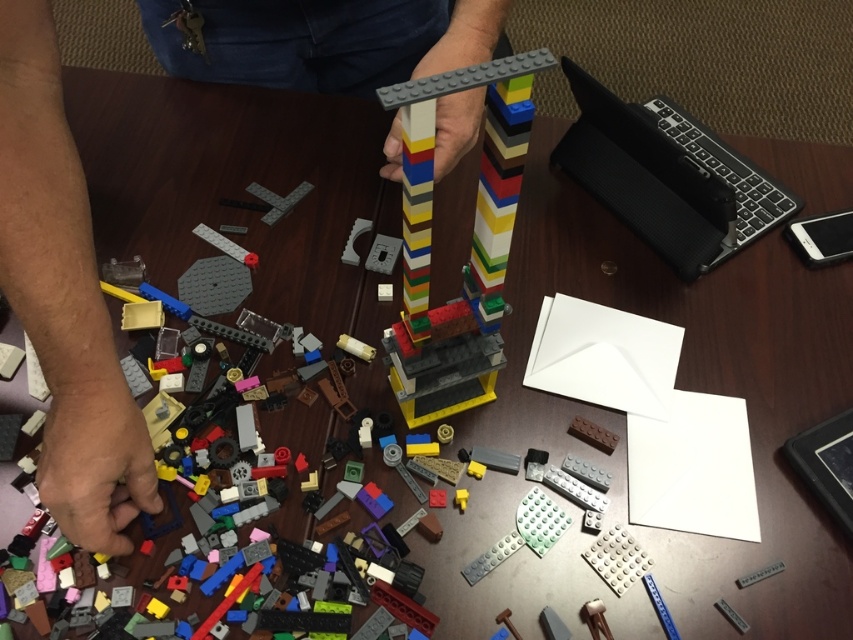
Which is more to the right, smooth plastic hands at center or smooth skin hand at lower left?

smooth skin hand at lower left

Can you confirm if smooth plastic hands at center is positioned above smooth skin hand at lower left?

No, smooth plastic hands at center is not above smooth skin hand at lower left.

Is point (22, 68) positioned behind point (64, 342)?

Yes, point (22, 68) is farther from viewer.

What are the coordinates of `smooth plastic hands at center` in the screenshot? It's located at (62, 298).

Can you confirm if black textured laptop at upper right is positioned to the left of multicolored plastic tower at center?

In fact, black textured laptop at upper right is to the right of multicolored plastic tower at center.

Between black textured laptop at upper right and multicolored plastic tower at center, which one has less height?

black textured laptop at upper right is shorter.

Between point (619, 204) and point (492, 77), which one is positioned in front?

Point (492, 77)

You are a GUI agent. You are given a task and a screenshot of the screen. Output one action in this format:
    pyautogui.click(x=<x>, y=<y>)
    Task: Click on the black textured laptop at upper right
    
    Given the screenshot: What is the action you would take?
    pyautogui.click(x=666, y=177)

Is smooth skin hand at lower left positioned before multicolored plastic tower at center?

No, smooth skin hand at lower left is further to the viewer.

Is smooth skin hand at lower left positioned at the back of multicolored plastic tower at center?

Yes, smooth skin hand at lower left is further from the viewer.

Which is behind, point (28, 326) or point (408, 172)?

Point (28, 326)

The width and height of the screenshot is (853, 640). Find the location of `smooth skin hand at lower left`. smooth skin hand at lower left is located at coordinates (64, 298).